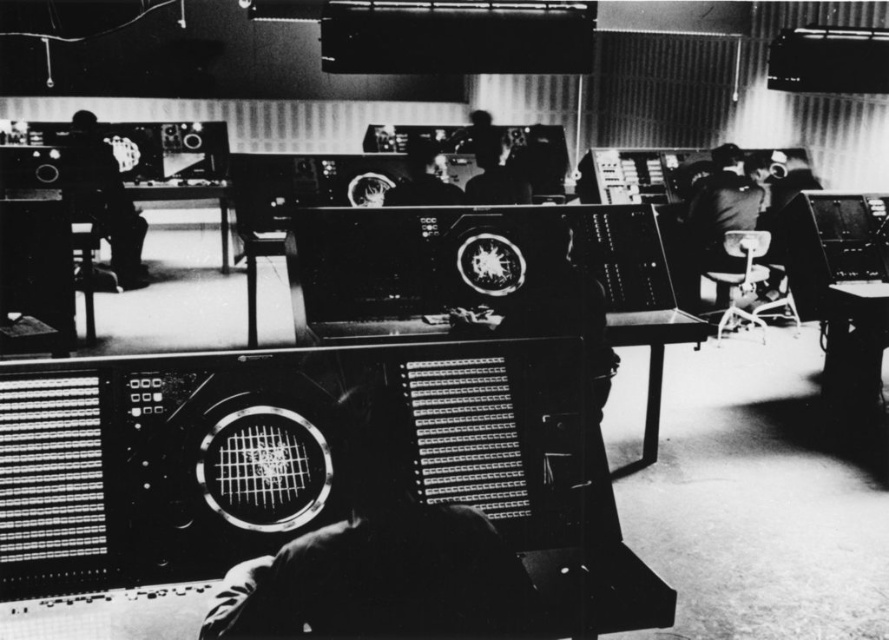
You are an engineer in the control room. You need to access both the silhouette of person at left and the smooth black head at center. Which object is wider so you can plan your workspace accordingly?

The silhouette of person at left is wider than the smooth black head at center, so you should allocate more space for the silhouette of person at left in your workspace.

You are standing in the control room and need to reach the metallic panel at center from the silhouette of person at left. Is the distance sufficient for you to walk directly to it without needing to navigate around any obstacles?

The metallic panel at center and silhouette of person at left are 6.02 meters apart from each other, so yes, the distance is sufficient for you to walk directly to it without needing to navigate around any obstacles.